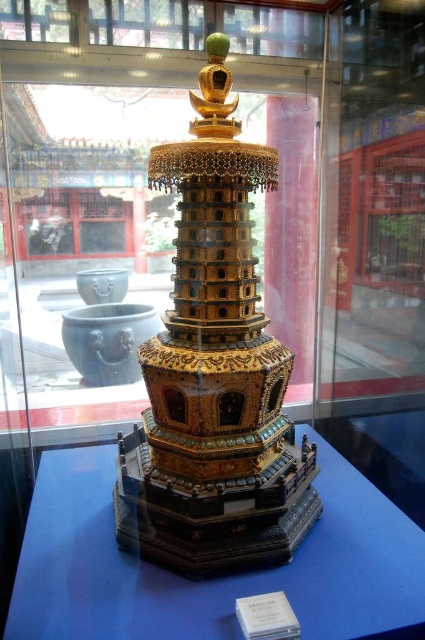
Looking at this image, does gold/gilded wood tower at center have a lesser height compared to transparent glass table at center?

In fact, gold/gilded wood tower at center may be taller than transparent glass table at center.

Which is below, gold/gilded wood tower at center or transparent glass table at center?

transparent glass table at center is below.

Is point (187, 285) less distant than point (88, 598)?

No.

Identify the location of gold/gilded wood tower at center. This screenshot has width=425, height=640. (214, 371).